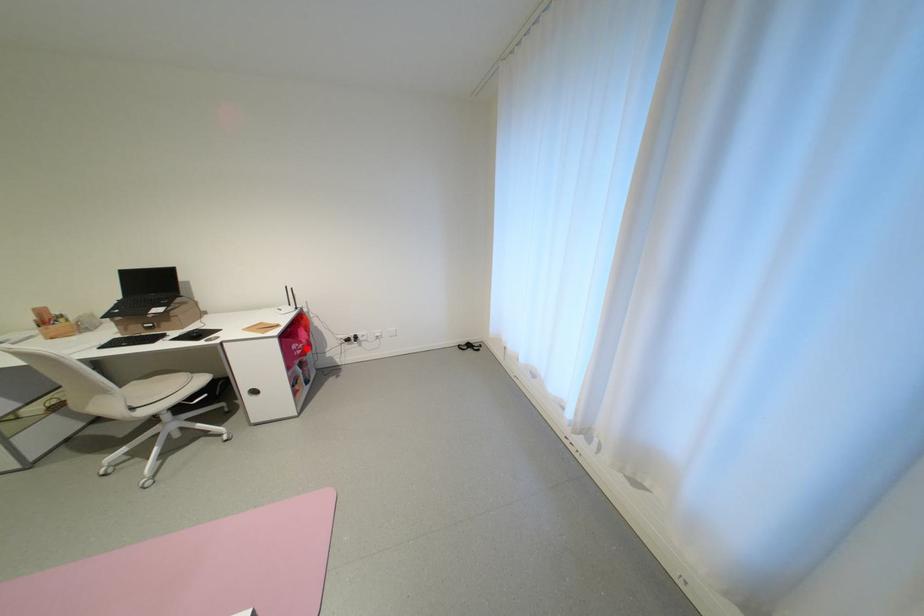
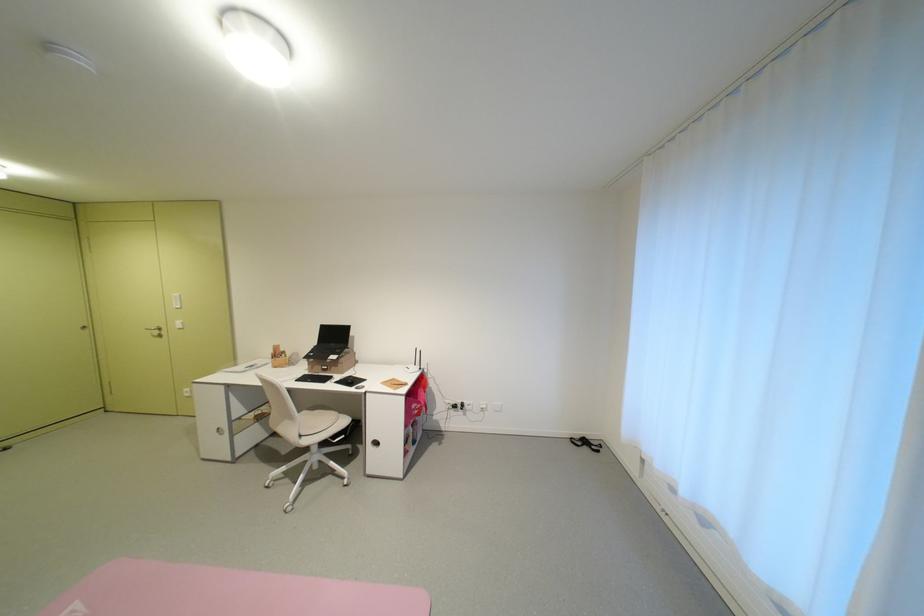
In the second image, find the point that corresponds to the highlighted location in the first image.

(424, 408)